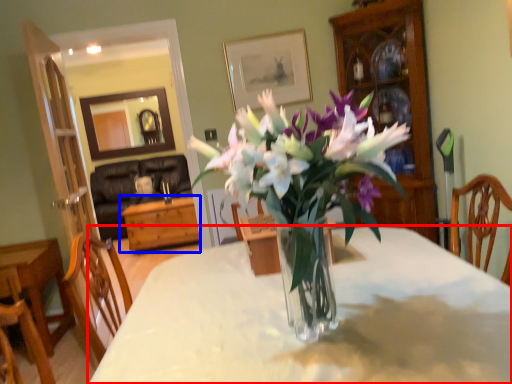
Question: Which of the following is the closest to the observer, desk (highlighted by a red box) or table (highlighted by a blue box)?

Choices:
 (A) desk
 (B) table

Answer: (A)